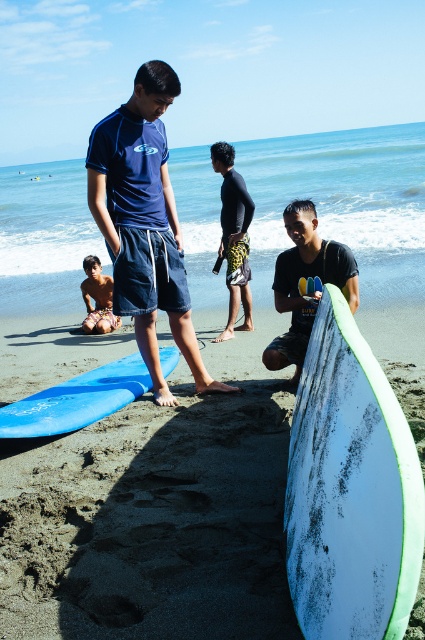
Can you confirm if matte black surfboard at lower right is shorter than shiny skin body at lower left?

No.

Between point (274, 365) and point (88, 273), which one is positioned behind?

Positioned behind is point (88, 273).

In order to click on matte black surfboard at lower right in this screenshot , I will do `click(306, 276)`.

Can you confirm if matte blue shorts at center is positioned below matte black surfboard at lower right?

Actually, matte blue shorts at center is above matte black surfboard at lower right.

Does matte blue shorts at center have a lesser height compared to matte black surfboard at lower right?

In fact, matte blue shorts at center may be taller than matte black surfboard at lower right.

Who is more forward, (x=121, y=237) or (x=351, y=310)?

Point (x=351, y=310) is more forward.

Where is `matte blue shorts at center`? This screenshot has height=640, width=425. matte blue shorts at center is located at coordinates (144, 224).

Is point (396, 534) farther from viewer compared to point (299, 227)?

No, (396, 534) is in front of (299, 227).

Which is below, white matte surfboard at lower right or matte black surfboard at lower right?

Positioned lower is white matte surfboard at lower right.

Between point (311, 364) and point (354, 298), which one is positioned in front?

Point (311, 364)

Where is `white matte surfboard at lower right`? white matte surfboard at lower right is located at coordinates (351, 490).